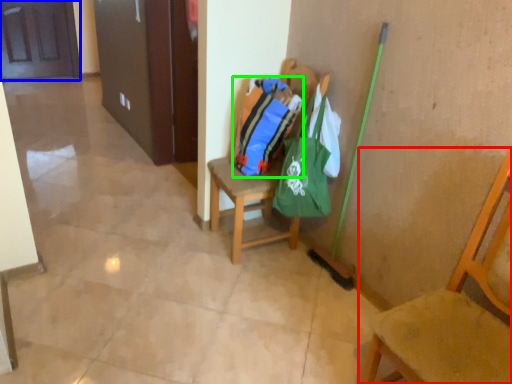
Question: Which is nearer to the chair (highlighted by a red box)? door (highlighted by a blue box) or bag (highlighted by a green box).

Choices:
 (A) door
 (B) bag

Answer: (B)